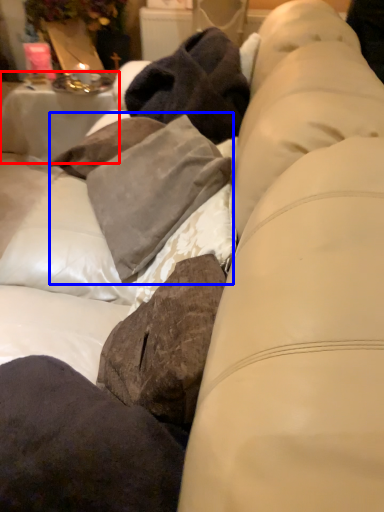
Question: Which object is closer to the camera taking this photo, table (highlighted by a red box) or clothing (highlighted by a blue box)?

Choices:
 (A) table
 (B) clothing

Answer: (B)